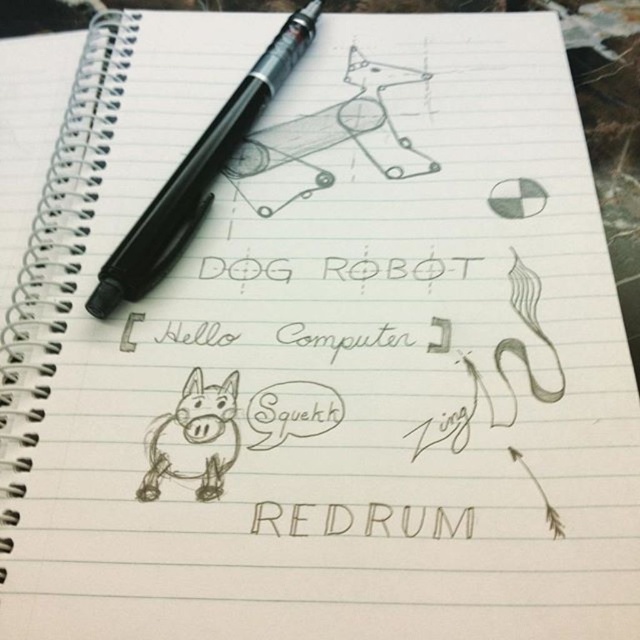
You are a student trying to write a note about the dog robot. You see the black plastic pen at upper left and the black ink word at center. Which object is closer to the top of the notebook page?

The black plastic pen at upper left is above the black ink word at center, so it is closer to the top of the notebook page.

You are an artist trying to place a 30 cm ruler between the black plastic pen at upper left and the brown sketchy donkey at lower left. Can the ruler fit horizontally between them?

The black plastic pen at upper left is 28.53 centimeters away from the brown sketchy donkey at lower left. Since the distance between them is less than 30 cm, the ruler cannot fit horizontally between them.

Based on the scene description, where is the brown sketchy donkey located in relation to the point labeled at coordinates (195, 438)?

The brown sketchy donkey at lower left is located exactly at the point labeled at coordinates (195, 438).